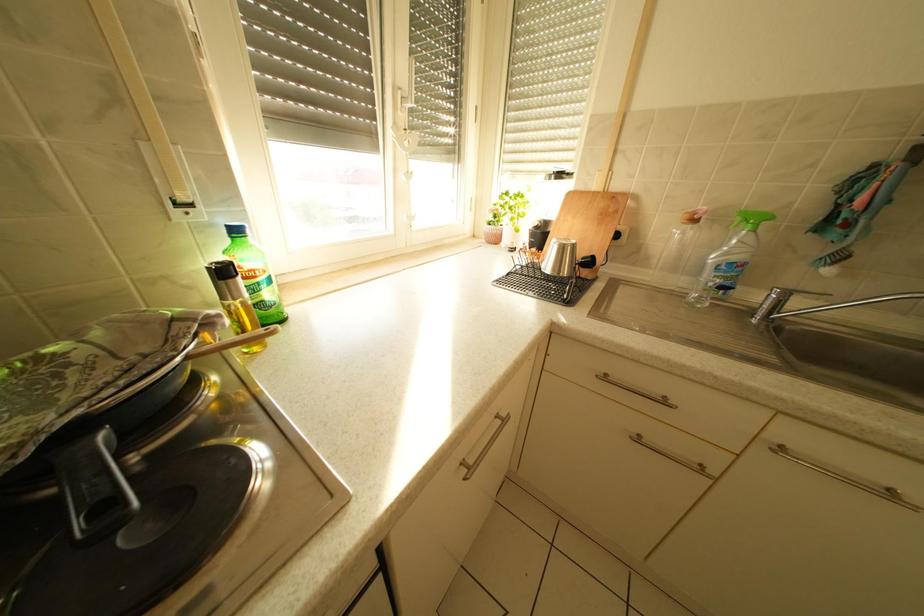
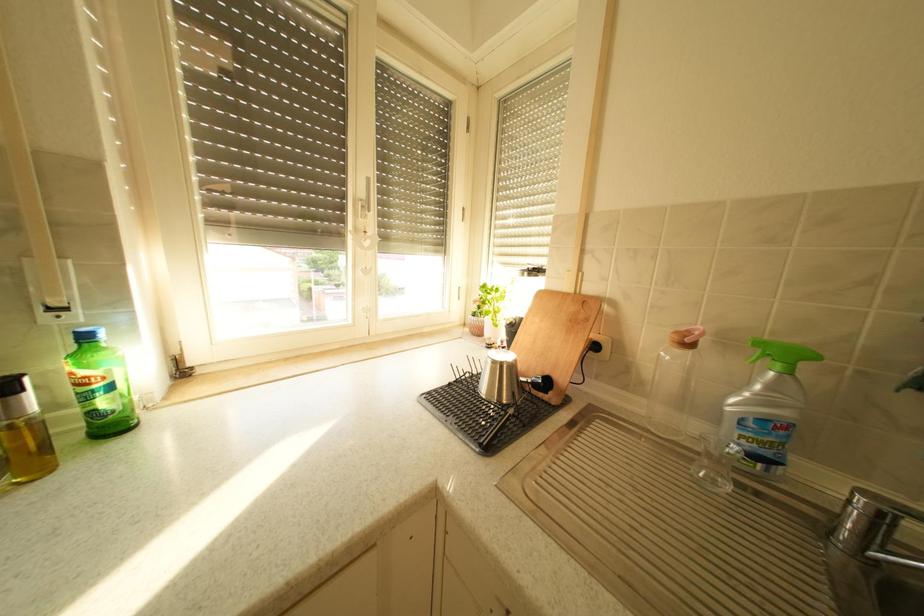
Question: The first image is from the beginning of the video and the second image is from the end. How did the camera likely rotate when shooting the video?

Choices:
 (A) Left
 (B) Right
 (C) Up
 (D) Down

Answer: (C)